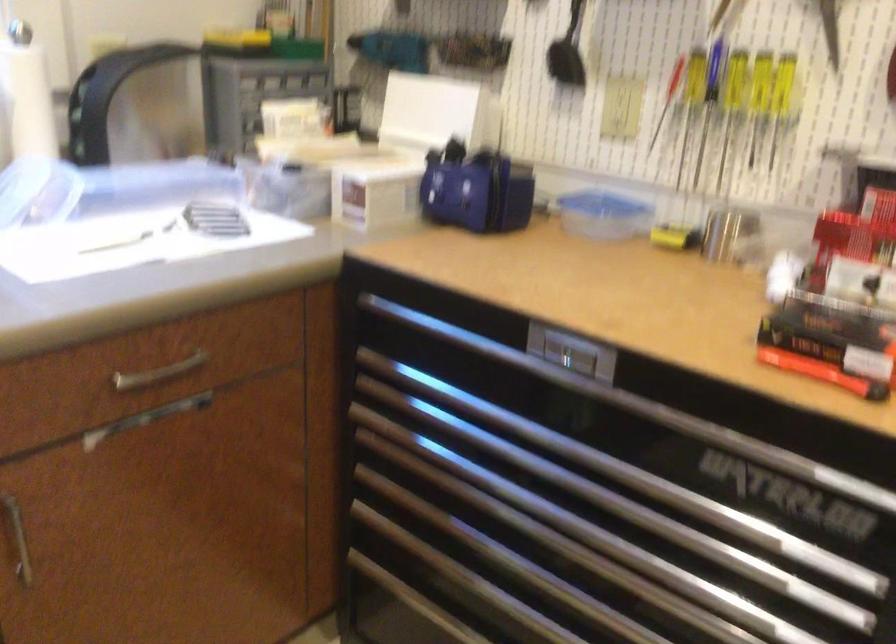
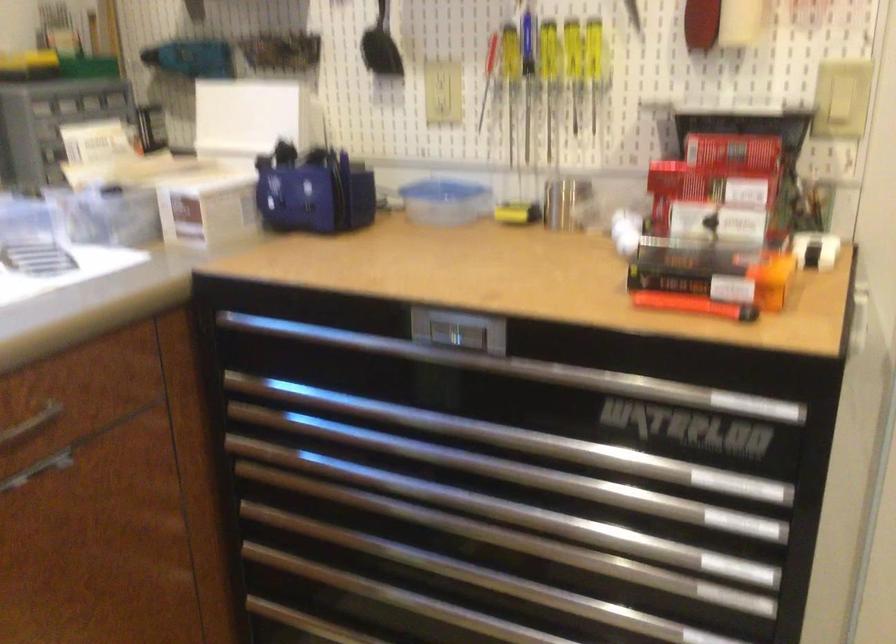
What movement of the cameraman would produce the second image?

The cameraman moved toward left, forward.